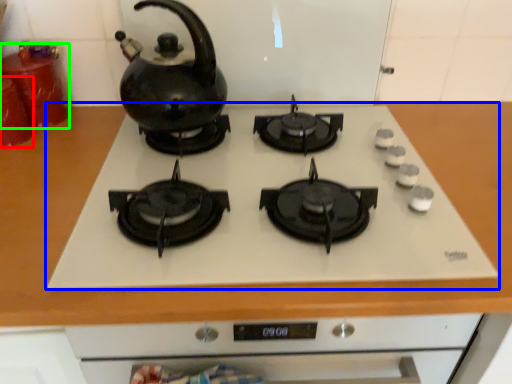
Question: Based on their relative distances, which object is nearer to kitchen appliance (highlighted by a red box)? Choose from gas stove (highlighted by a blue box) and kitchen appliance (highlighted by a green box).

Choices:
 (A) gas stove
 (B) kitchen appliance

Answer: (B)